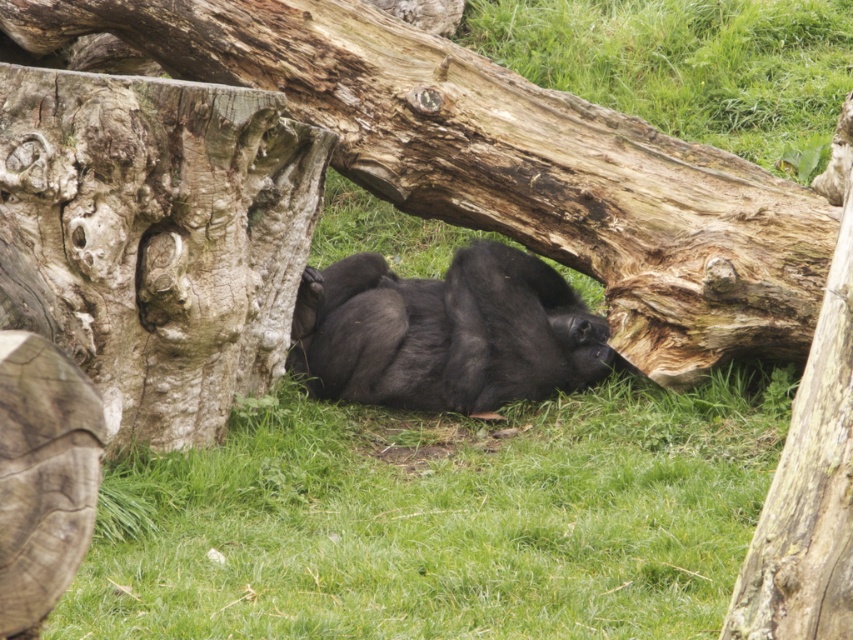
Question: Is smooth brown log at center thinner than rough bark tree trunk at left?

Choices:
 (A) yes
 (B) no

Answer: (B)

Question: Is the position of green grass at lower center more distant than that of rough bark tree trunk at left?

Choices:
 (A) yes
 (B) no

Answer: (B)

Question: Which object appears farthest from the camera in this image?

Choices:
 (A) green grass at lower center
 (B) smooth brown log at center
 (C) rough bark tree trunk at left

Answer: (B)

Question: Which object appears farthest from the camera in this image?

Choices:
 (A) black fur gorilla at center
 (B) green grass at lower center
 (C) smooth brown log at center
 (D) rough bark tree trunk at left

Answer: (A)

Question: Which object is farther from the camera taking this photo?

Choices:
 (A) black fur gorilla at center
 (B) green grass at lower center

Answer: (A)

Question: Does green grass at lower center appear under black fur gorilla at center?

Choices:
 (A) yes
 (B) no

Answer: (A)